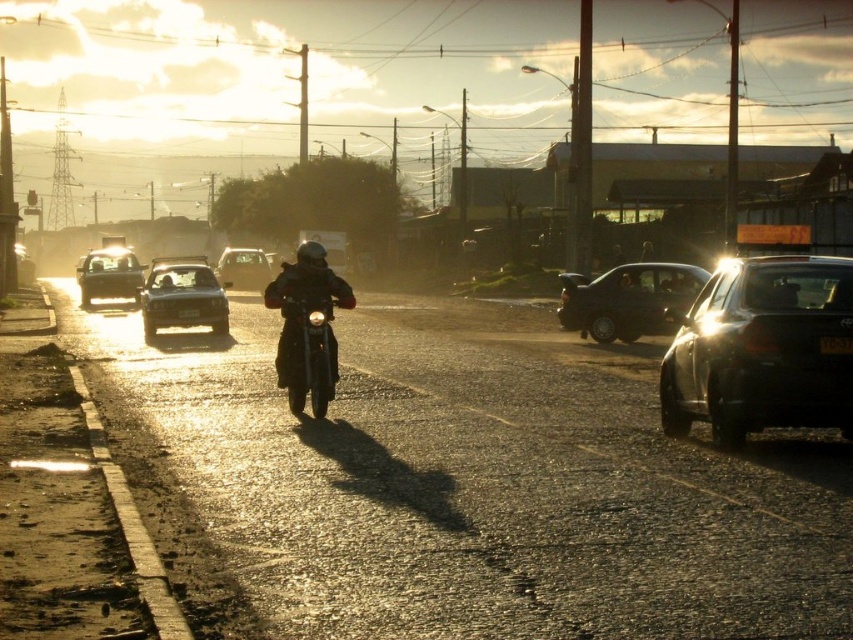
Which is below, shiny black sedan at center or shiny silver sedan at left?

Positioned lower is shiny black sedan at center.

Is point (183, 314) closer to camera compared to point (143, 280)?

Yes, point (183, 314) is closer to viewer.

Where is `shiny black sedan at center`? The height and width of the screenshot is (640, 853). shiny black sedan at center is located at coordinates (183, 296).

Between point (688, 332) and point (263, 262), which one is positioned behind?

The point (263, 262) is behind.

Who is higher up, satin black sedan at right or metallic silver sedan at center?

metallic silver sedan at center is above.

What do you see at coordinates (763, 349) in the screenshot? The width and height of the screenshot is (853, 640). I see `satin black sedan at right` at bounding box center [763, 349].

Identify the location of satin black sedan at right. tap(763, 349).

Is point (572, 280) positioned in front of point (241, 284)?

Yes, it is.

Can you confirm if black glossy sedan at center right is positioned to the left of metallic silver sedan at center?

Incorrect, black glossy sedan at center right is not on the left side of metallic silver sedan at center.

Who is more distant from viewer, (596,320) or (241,280)?

Positioned behind is point (241,280).

Locate an element on the screen. This screenshot has width=853, height=640. black glossy sedan at center right is located at coordinates (628, 300).